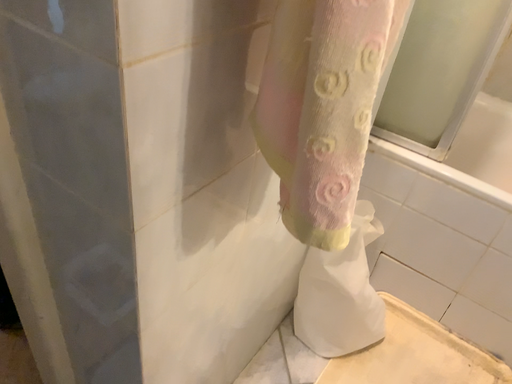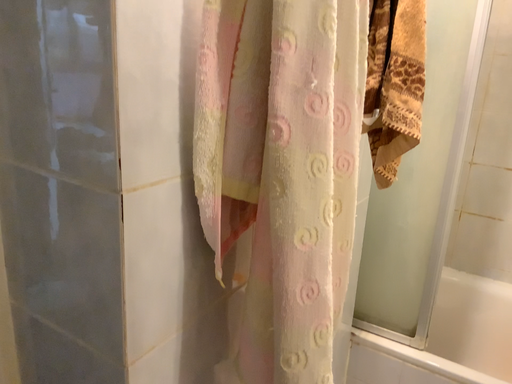
Question: How did the camera likely rotate when shooting the video?

Choices:
 (A) rotated downward
 (B) rotated upward

Answer: (B)